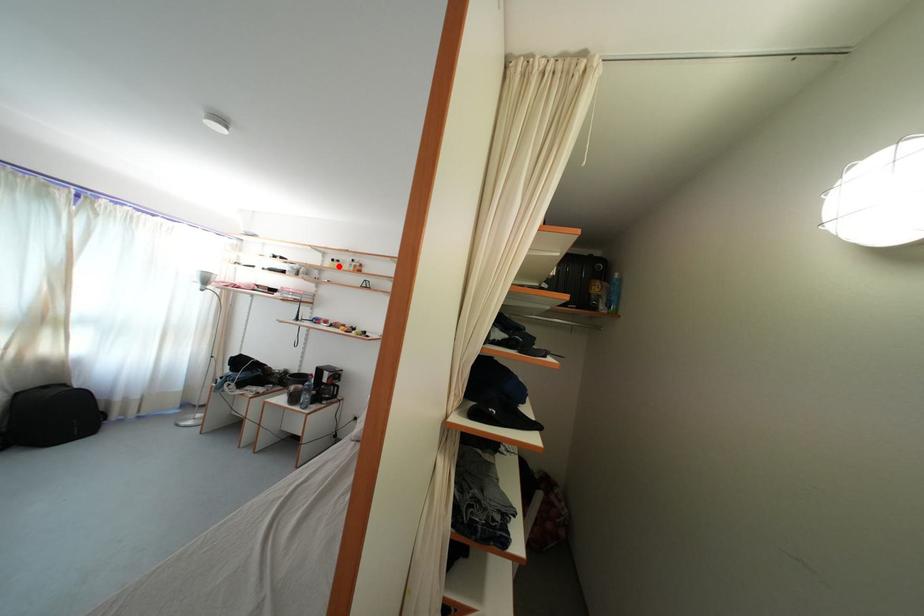
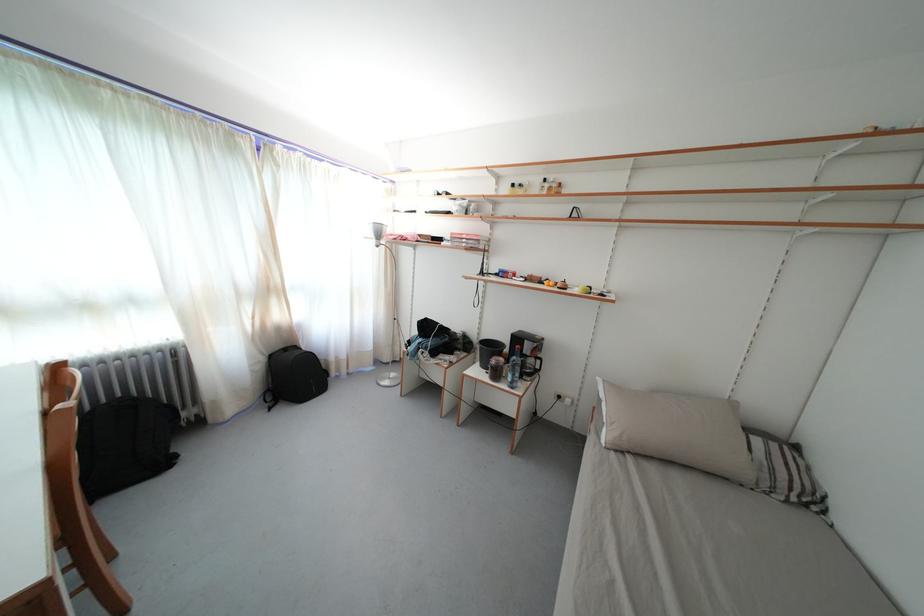
The point at the highlighted location is marked in the first image. Where is the corresponding point in the second image?

(518, 191)